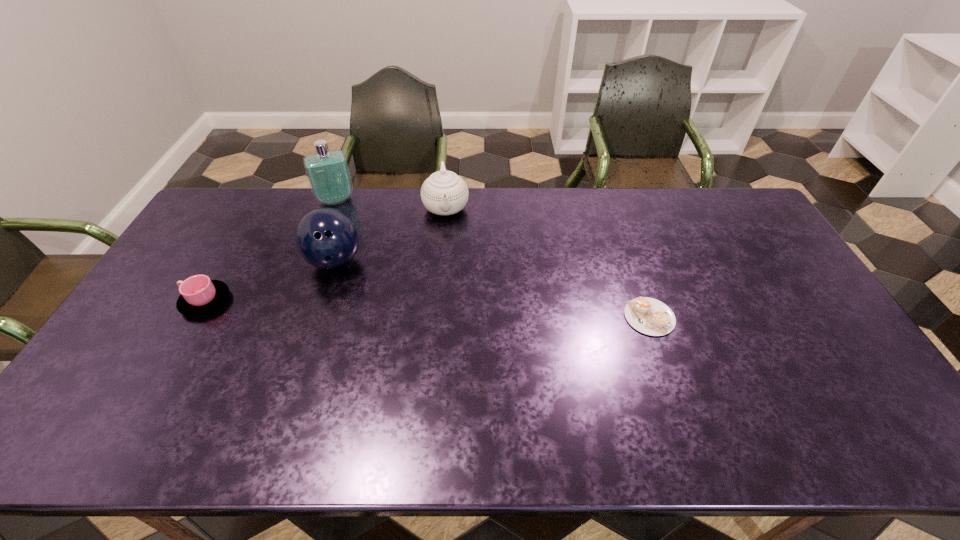
You are a GUI agent. You are given a task and a screenshot of the screen. Output one action in this format:
    pyautogui.click(x=<x>, y=<y>)
    Task: Click on the object located in the left edge section of the desktop
    The width and height of the screenshot is (960, 540).
    Given the screenshot: What is the action you would take?
    pyautogui.click(x=199, y=295)

In the image, there is a desktop. Where is `blank space at the far edge`? This screenshot has height=540, width=960. blank space at the far edge is located at coordinates (562, 227).

The image size is (960, 540). Find the location of `vacant space at the near edge of the desktop`. vacant space at the near edge of the desktop is located at coordinates (687, 393).

Locate an element on the screen. The width and height of the screenshot is (960, 540). vacant space at the right edge of the desktop is located at coordinates (762, 249).

Find the location of a particular element. free space that is in between the leftmost object and the tallest object is located at coordinates (271, 251).

Locate an element on the screen. This screenshot has width=960, height=540. free point between the bowling ball and the leftmost object is located at coordinates 270,281.

Where is `free space between the tallest object and the rightmost object`? free space between the tallest object and the rightmost object is located at coordinates (492, 258).

You are a GUI agent. You are given a task and a screenshot of the screen. Output one action in this format:
    pyautogui.click(x=<x>, y=<y>)
    Task: Click on the empty space that is in between the leftmost object and the third nearest object
    
    Given the screenshot: What is the action you would take?
    pyautogui.click(x=270, y=281)

Where is `unoccupied area between the fourth object from left to right and the perfume`? Image resolution: width=960 pixels, height=540 pixels. unoccupied area between the fourth object from left to right and the perfume is located at coordinates (391, 204).

The image size is (960, 540). I want to click on unoccupied position between the chinaware and the third farthest object, so click(391, 234).